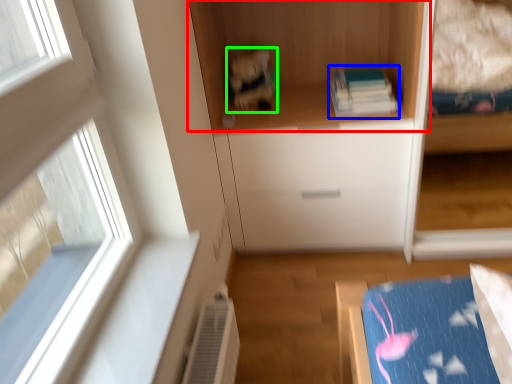
Question: Which is farther away from cupboard (highlighted by a red box)? book (highlighted by a blue box) or toy (highlighted by a green box)?

Choices:
 (A) book
 (B) toy

Answer: (A)